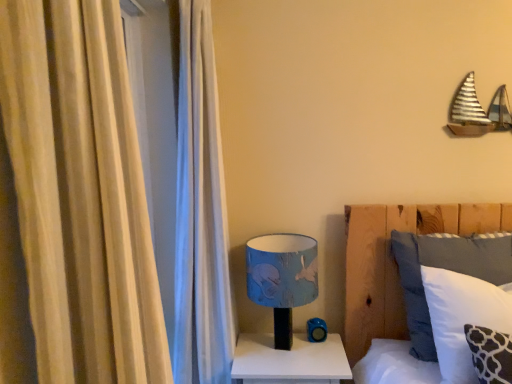
You are a GUI agent. You are given a task and a screenshot of the screen. Output one action in this format:
    pyautogui.click(x=<x>, y=<y>)
    Task: Click on the free region under blue fabric lampshade at center (from a real-world perspective)
    Image resolution: width=512 pixels, height=384 pixels.
    Given the screenshot: What is the action you would take?
    pyautogui.click(x=279, y=352)